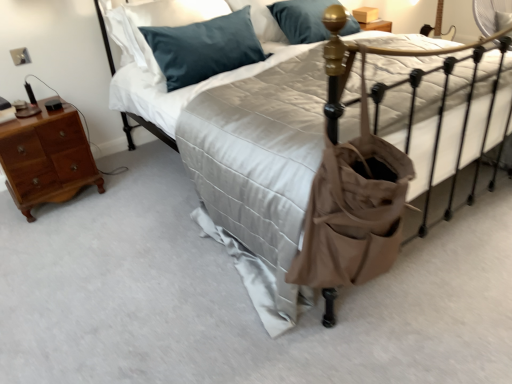
Image resolution: width=512 pixels, height=384 pixels. Identify the location of vacant area to the right of light brown wood nightstand at left. (121, 189).